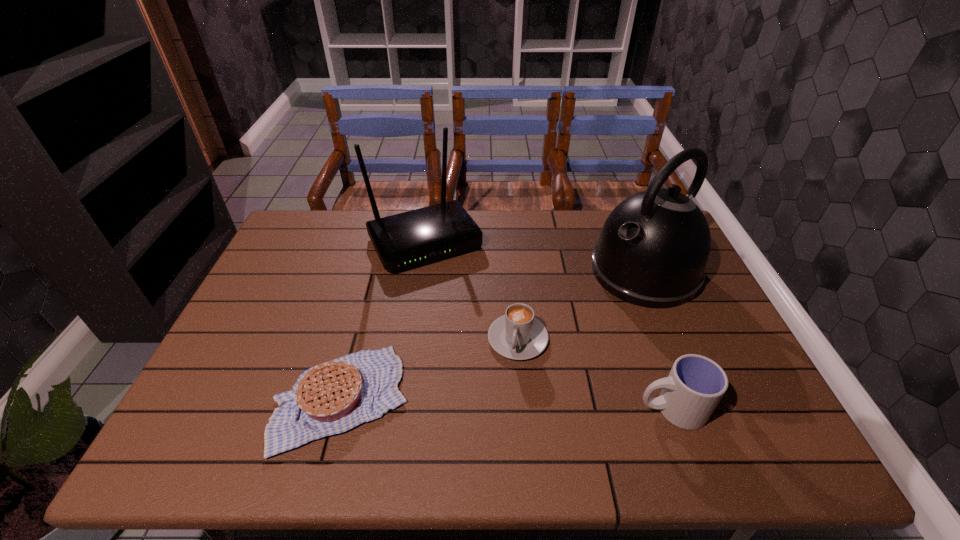
At what (x,y) coordinates should I click in order to perform the action: click on vacant space that's between the third tallest object and the router. Please return your answer as a coordinate pair (x, y). Looking at the image, I should click on (548, 325).

Identify the location of vacant area that lies between the third object from right to left and the kettle. This screenshot has height=540, width=960. (581, 305).

Identify the location of object that is the fourth nearest to the kettle. This screenshot has height=540, width=960. (333, 397).

Point out which object is positioned as the second nearest to the shortest object. Please provide its 2D coordinates. Your answer should be formatted as a tuple, i.e. [(x, y)], where the tuple contains the x and y coordinates of a point satisfying the conditions above.

[(411, 238)]

In order to click on free space that satisfies the following two spatial constraints: 1. on the front side of the cup; 2. with the handle on the side of the cappuccino in this screenshot , I will do pyautogui.click(x=523, y=409).

Identify the location of vacant position in the image that satisfies the following two spatial constraints: 1. on the front side of the cappuccino; 2. with the handle on the side of the third shortest object. The image size is (960, 540). (523, 409).

Locate an element on the screen. free space that satisfies the following two spatial constraints: 1. on the back side of the third object from right to left; 2. on the right side of the pie is located at coordinates (357, 339).

This screenshot has width=960, height=540. In order to click on vacant space that satisfies the following two spatial constraints: 1. on the front side of the third object from left to right; 2. with the handle on the side of the third shortest object in this screenshot , I will do `click(523, 409)`.

Where is `free spot that satisfies the following two spatial constraints: 1. on the front side of the shortest object; 2. with the handle on the side of the third tallest object`? free spot that satisfies the following two spatial constraints: 1. on the front side of the shortest object; 2. with the handle on the side of the third tallest object is located at coordinates (x=339, y=409).

Locate an element on the screen. The height and width of the screenshot is (540, 960). free space that satisfies the following two spatial constraints: 1. on the front side of the third shortest object; 2. with the handle on the side of the cappuccino is located at coordinates (523, 409).